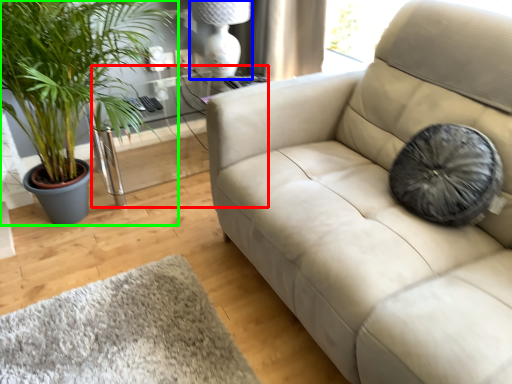
Question: Which object is the closest to the table (highlighted by a red box)? Choose among these: lamp (highlighted by a blue box) or houseplant (highlighted by a green box).

Choices:
 (A) lamp
 (B) houseplant

Answer: (A)